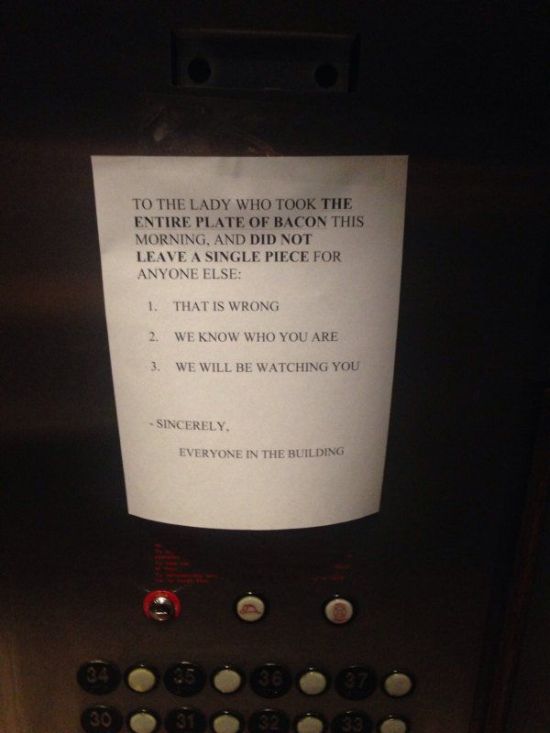
This screenshot has height=733, width=550. What are the coordinates of `wall` in the screenshot? It's located at (35, 556).